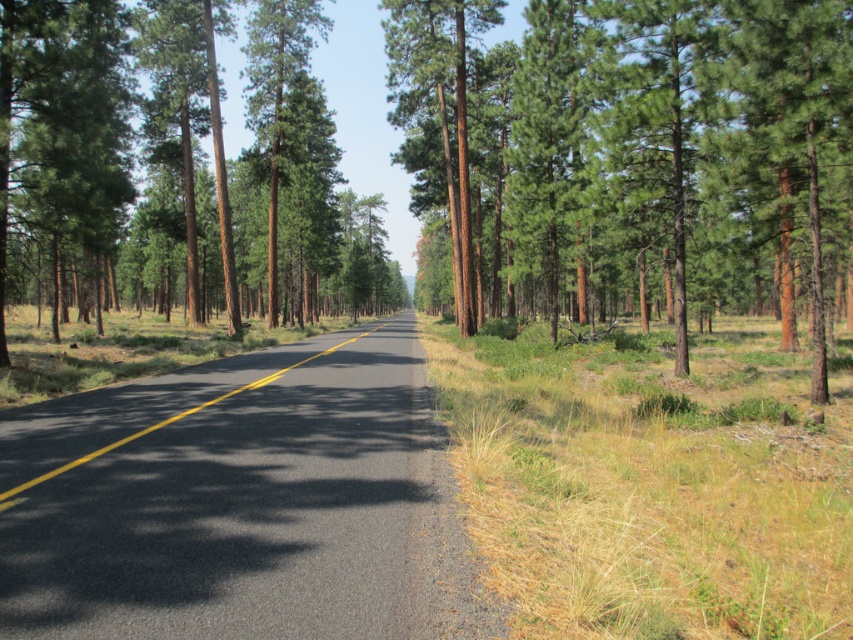
You are standing on the asphalt road and see a point marked at coordinates (637, 148). What object does this point correspond to?

The point at coordinates (637, 148) corresponds to the green rough bark tree at center.

You are a hiker standing at the edge of the forest road. You see the green rough bark tree at center in front of you. If you want to reach the tree, how many steps of 3 feet each would you need to take?

The distance between you and the green rough bark tree at center is 37.86 feet. Each step covers 3 feet, so dividing 37.86 by 3 gives approximately 12.62 steps. Since you can only take whole steps, you would need to take 13 steps to reach the tree.

You are driving a car and need to determine the safest path forward. Based on the scene, which object is closer to you and should be considered for navigation? Please choose between the green rough bark tree at center and the black asphalt road at center.

The green rough bark tree at center is closer to you because the black asphalt road at center is positioned behind it, so you should prioritize navigating around the tree to stay on the road safely.